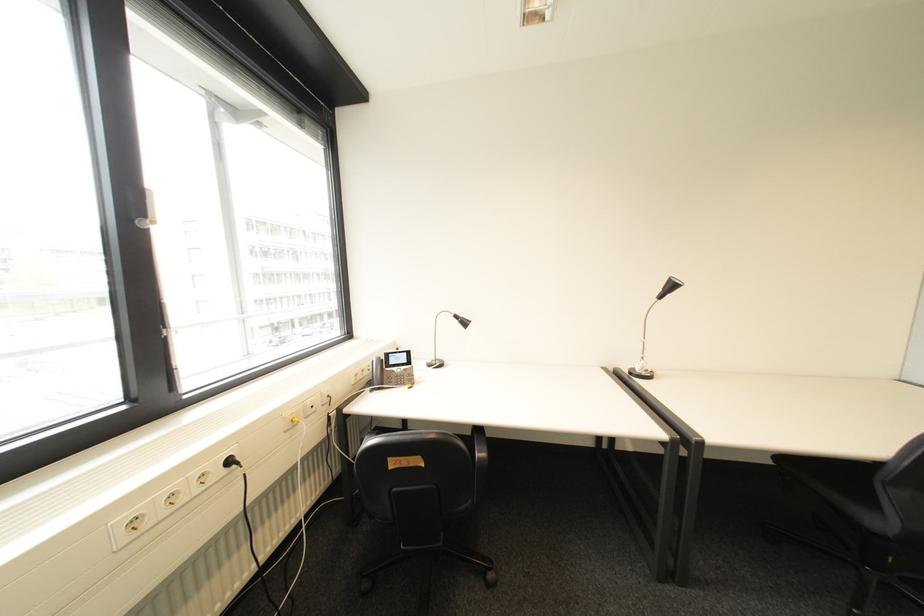
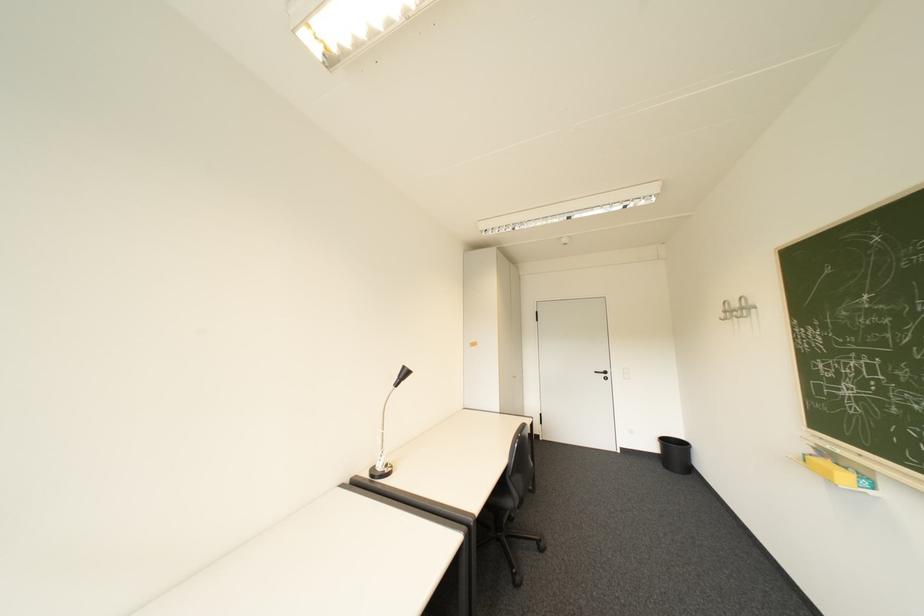
Question: The camera is either moving clockwise (left) or counter-clockwise (right) around the object. The first image is from the beginning of the video and the second image is from the end. Is the camera moving left or right when shooting the video?

Choices:
 (A) Left
 (B) Right

Answer: (A)